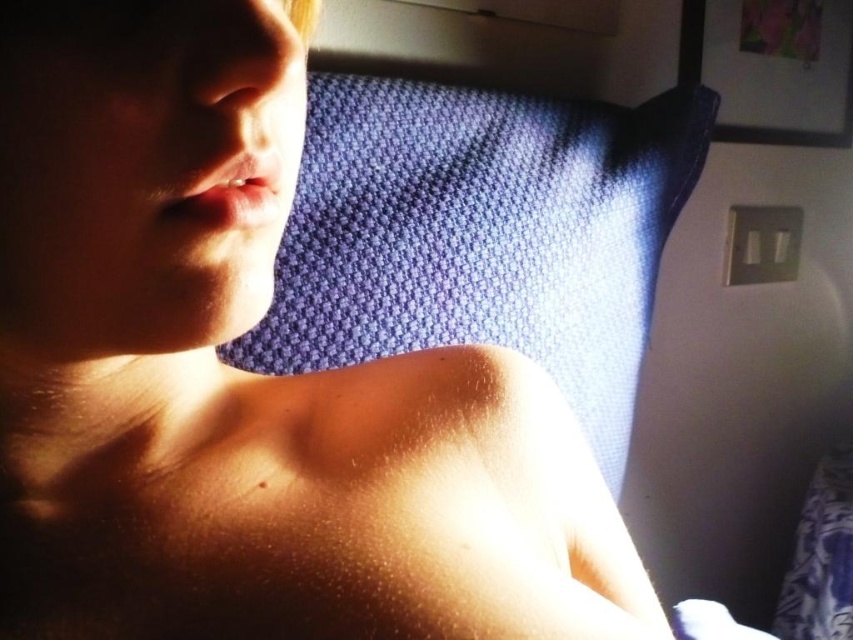
Does smooth skin at center have a greater height compared to blue textured pillow at upper center?

In fact, smooth skin at center may be shorter than blue textured pillow at upper center.

Does point (239, 509) lie behind point (318, 132)?

No, it is not.

This screenshot has width=853, height=640. I want to click on smooth skin at center, so click(305, 502).